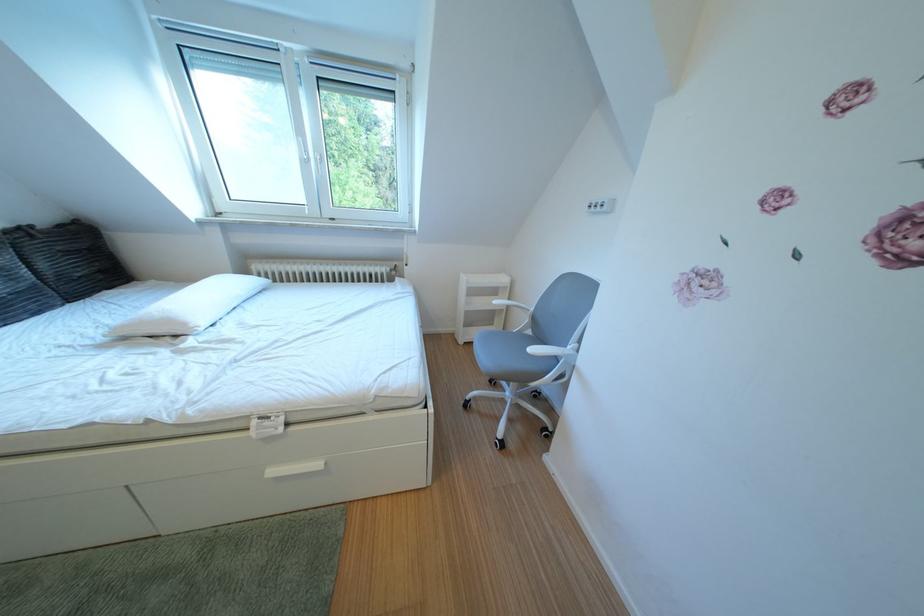
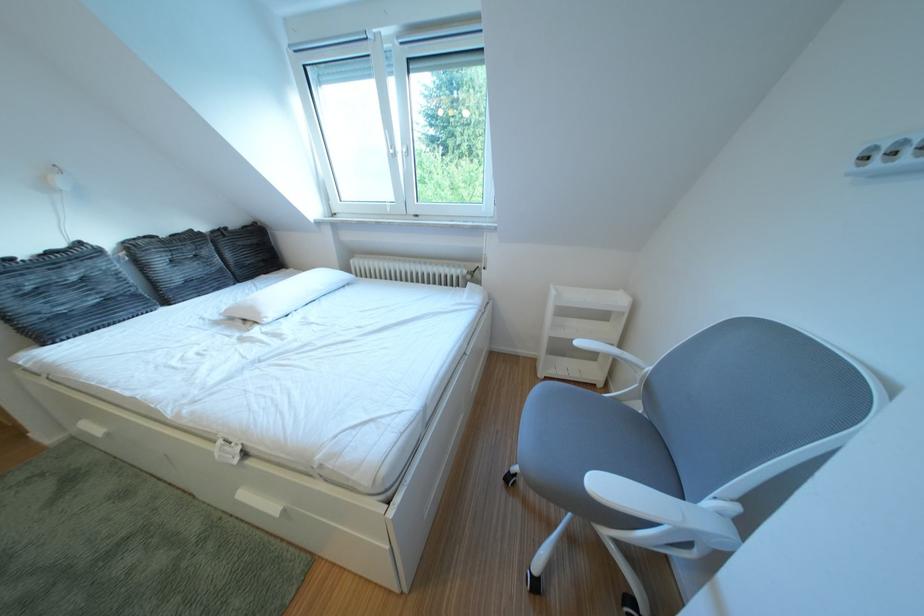
Locate, in the second image, the point that corresponds to point 54,224 in the first image.

(247, 228)